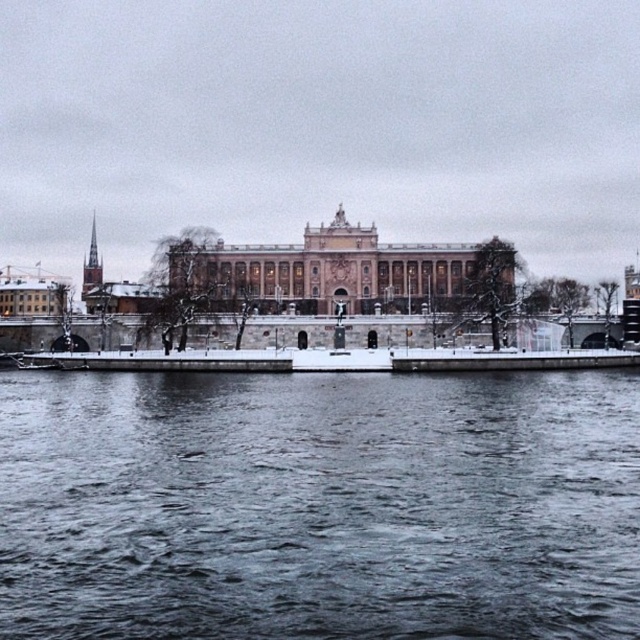
Who is higher up, dark gray water at lower center or pink stone building at center?

pink stone building at center is higher up.

Does dark gray water at lower center appear over pink stone building at center?

No, dark gray water at lower center is not above pink stone building at center.

Does point (224, 474) come farther from viewer compared to point (422, 264)?

No, it is not.

Where is `dark gray water at lower center`? The height and width of the screenshot is (640, 640). dark gray water at lower center is located at coordinates (320, 506).